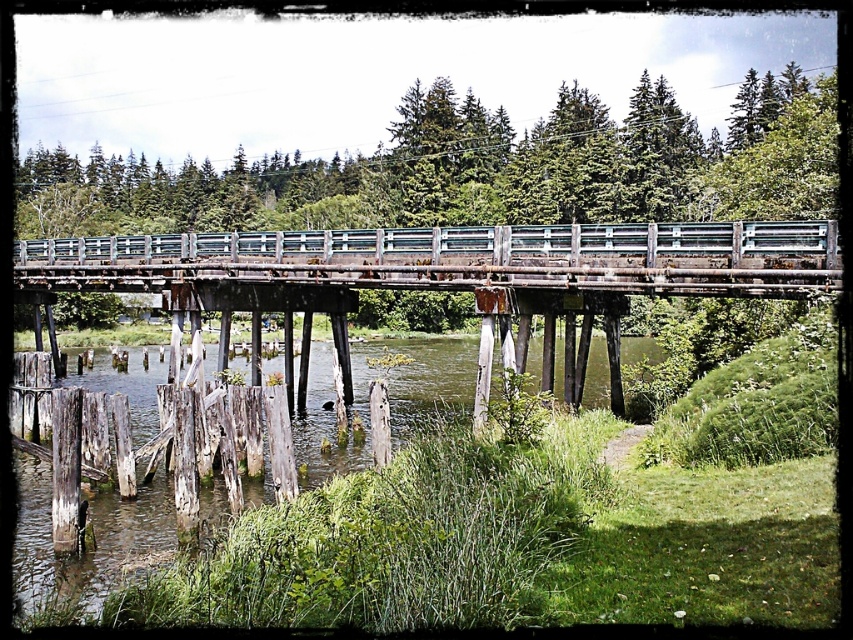
Does rusty metal bridge at center have a smaller size compared to wooden posts at lower left?

Yes, rusty metal bridge at center is smaller than wooden posts at lower left.

Is rusty metal bridge at center above wooden posts at lower left?

Yes, rusty metal bridge at center is above wooden posts at lower left.

This screenshot has height=640, width=853. What do you see at coordinates (453, 259) in the screenshot? I see `rusty metal bridge at center` at bounding box center [453, 259].

The image size is (853, 640). I want to click on rusty metal bridge at center, so pos(453,259).